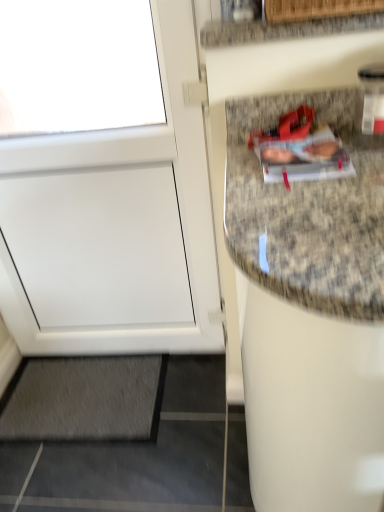
Question: Can you confirm if granite countertop at upper right is thinner than gray carpet at lower left?

Choices:
 (A) yes
 (B) no

Answer: (A)

Question: From a real-world perspective, is granite countertop at upper right below gray carpet at lower left?

Choices:
 (A) yes
 (B) no

Answer: (B)

Question: Does granite countertop at upper right appear on the right side of gray carpet at lower left?

Choices:
 (A) yes
 (B) no

Answer: (A)

Question: Is granite countertop at upper right not close to gray carpet at lower left?

Choices:
 (A) no
 (B) yes

Answer: (B)

Question: Is granite countertop at upper right shorter than gray carpet at lower left?

Choices:
 (A) no
 (B) yes

Answer: (A)

Question: Considering the relative positions of granite countertop at upper right and gray carpet at lower left in the image provided, is granite countertop at upper right in front of gray carpet at lower left?

Choices:
 (A) yes
 (B) no

Answer: (A)

Question: Is white matte door at left to the right of granite countertop at upper right from the viewer's perspective?

Choices:
 (A) yes
 (B) no

Answer: (B)

Question: From the image's perspective, is white matte door at left under granite countertop at upper right?

Choices:
 (A) no
 (B) yes

Answer: (B)

Question: Does white matte door at left appear on the left side of granite countertop at upper right?

Choices:
 (A) no
 (B) yes

Answer: (B)

Question: Is white matte door at left shorter than granite countertop at upper right?

Choices:
 (A) no
 (B) yes

Answer: (A)

Question: Does white matte door at left have a lesser width compared to granite countertop at upper right?

Choices:
 (A) yes
 (B) no

Answer: (A)

Question: Can you confirm if white matte door at left is smaller than granite countertop at upper right?

Choices:
 (A) no
 (B) yes

Answer: (A)

Question: Is white matte door at left completely or partially inside gray carpet at lower left?

Choices:
 (A) no
 (B) yes

Answer: (A)